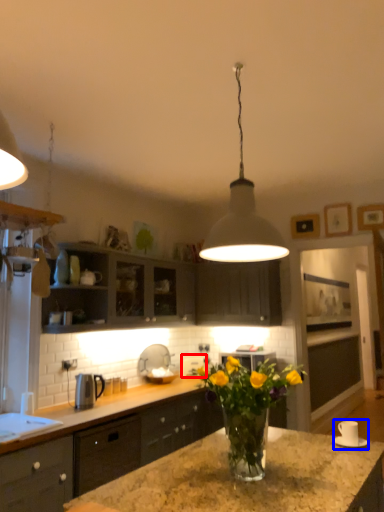
Question: Which of the following is the closest to the observer, appliance (highlighted by a red box) or appliance (highlighted by a blue box)?

Choices:
 (A) appliance
 (B) appliance

Answer: (B)